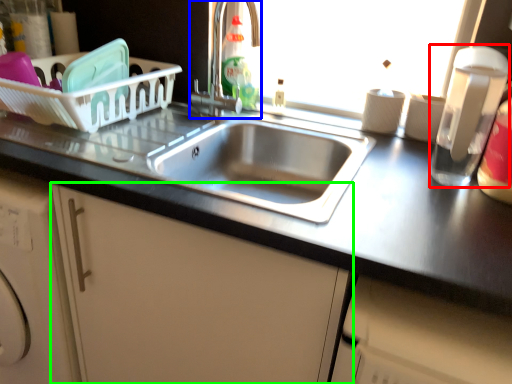
Question: Which object is positioned closest to appliance (highlighted by a red box)? Select from tap (highlighted by a blue box) and cabinetry (highlighted by a green box).

Choices:
 (A) tap
 (B) cabinetry

Answer: (B)